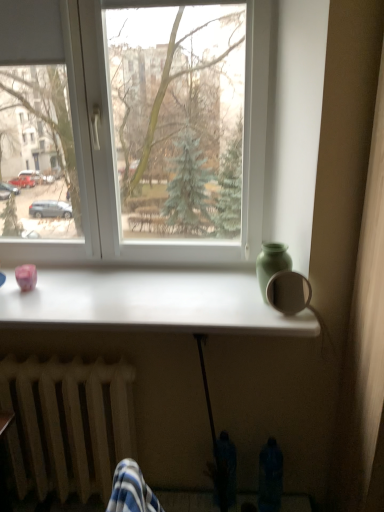
Find the location of `vacant area on top of white glossy table at center (from a real-world perspective)`. vacant area on top of white glossy table at center (from a real-world perspective) is located at coordinates (145, 289).